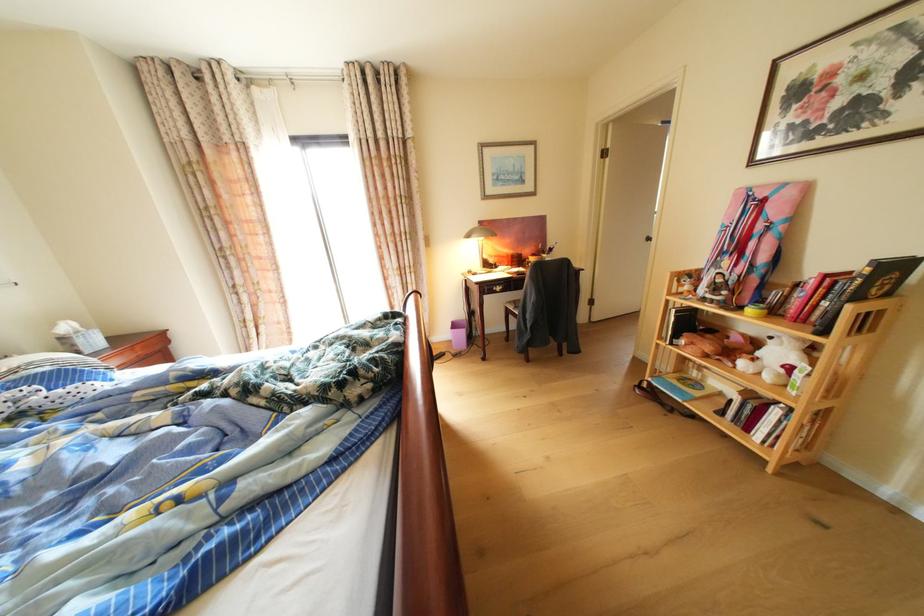
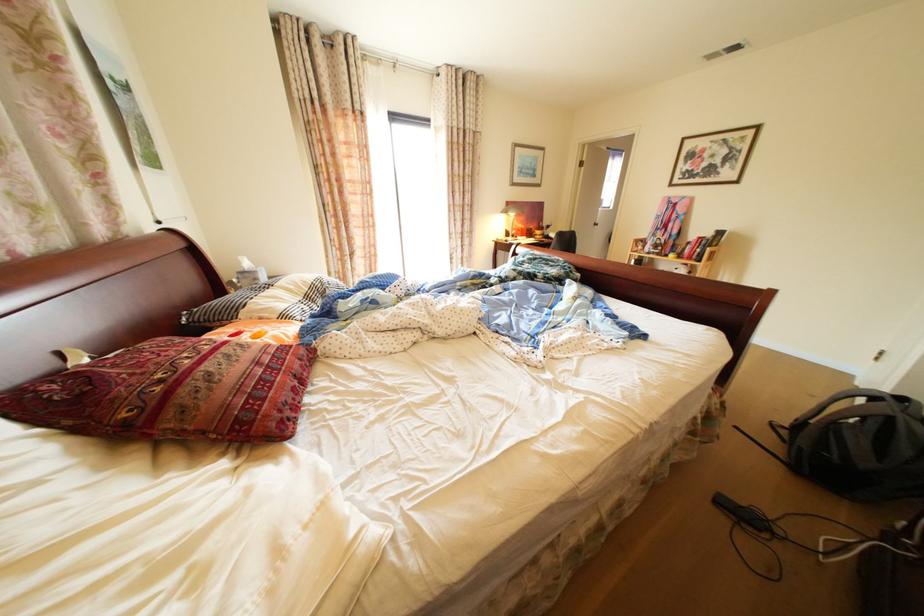
Find the pixel in the second image that matches point 78,342 in the first image.

(260, 277)